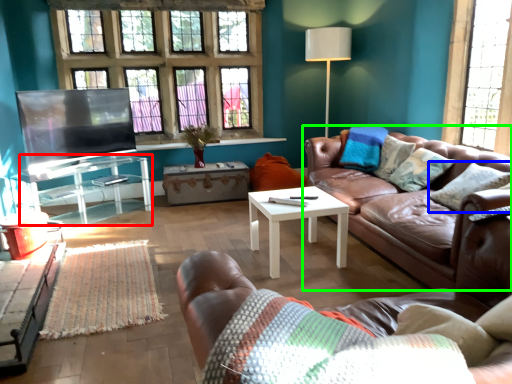
Question: Based on their relative distances, which object is nearer to table (highlighted by a red box)? Choose from pillow (highlighted by a blue box) and studio couch (highlighted by a green box).

Choices:
 (A) pillow
 (B) studio couch

Answer: (B)